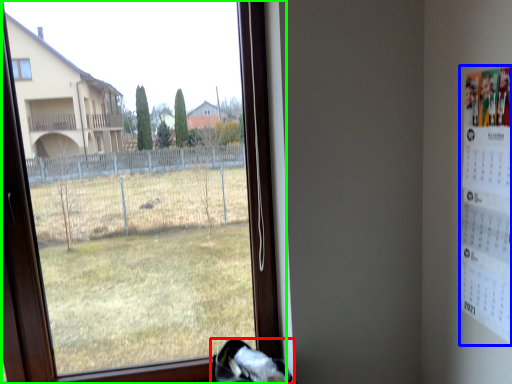
Question: Which object is positioned closest to shoe (highlighted by a red box)? Select from poster (highlighted by a blue box) and window (highlighted by a green box).

Choices:
 (A) poster
 (B) window

Answer: (A)